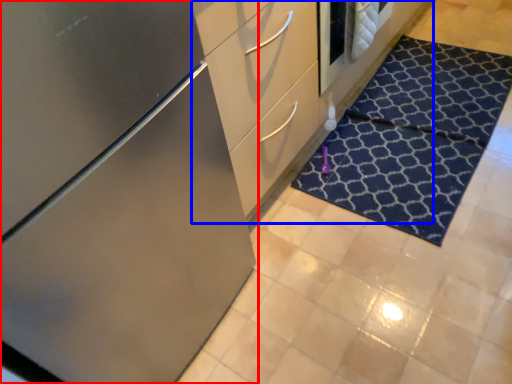
Question: Which object appears farthest to the camera in this image, cabinetry (highlighted by a red box) or dresser (highlighted by a blue box)?

Choices:
 (A) cabinetry
 (B) dresser

Answer: (B)